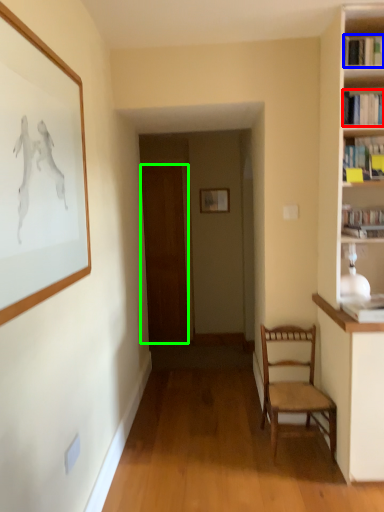
Question: Estimate the real-world distances between objects in this image. Which object is farther from book (highlighted by a red box), book (highlighted by a blue box) or door (highlighted by a green box)?

Choices:
 (A) book
 (B) door

Answer: (B)